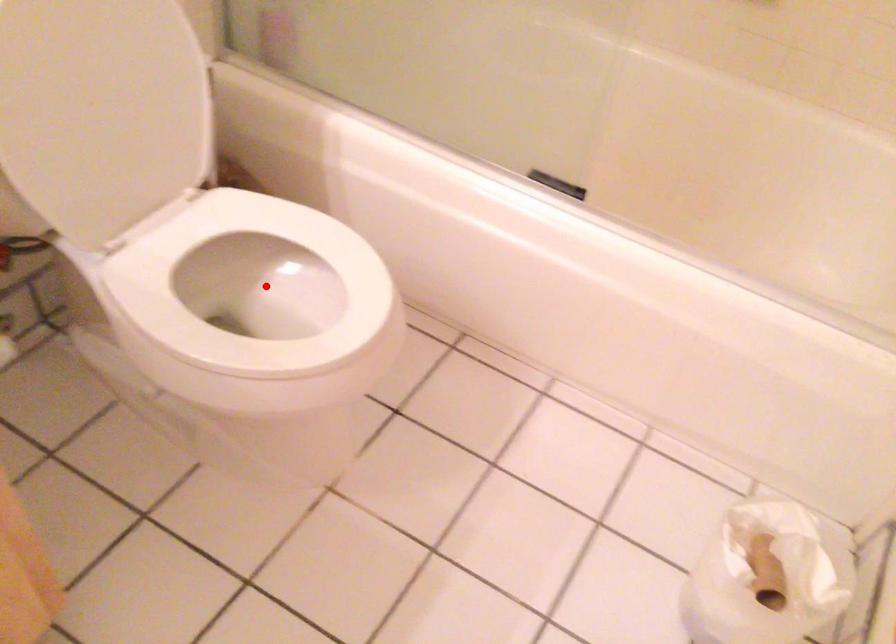
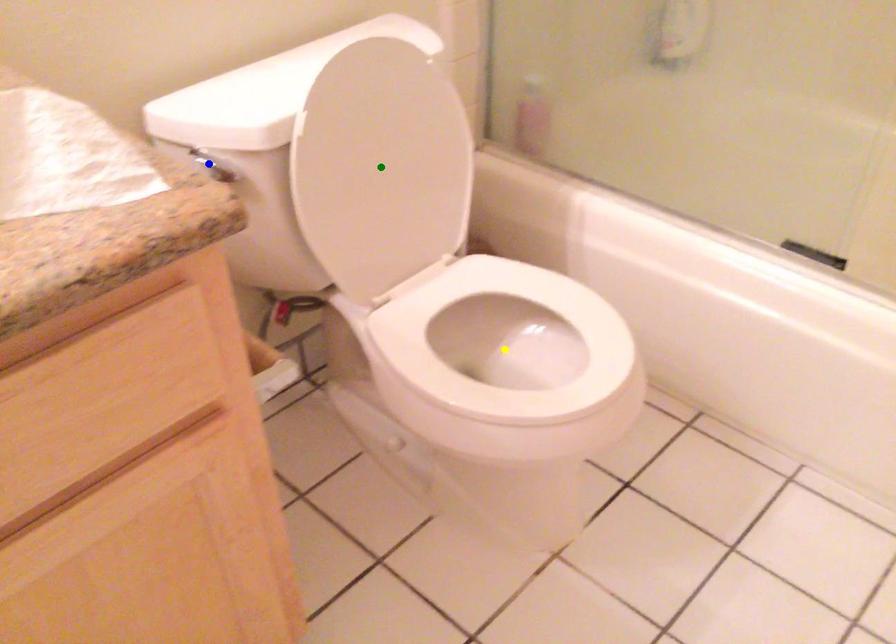
Question: I am providing you with two images of the same scene from different viewpoints. A red point is marked on the first image. You are given multiple points on the second image. Which mark in image 2 goes with the point in image 1?

Choices:
 (A) blue point
 (B) yellow point
 (C) green point

Answer: (B)